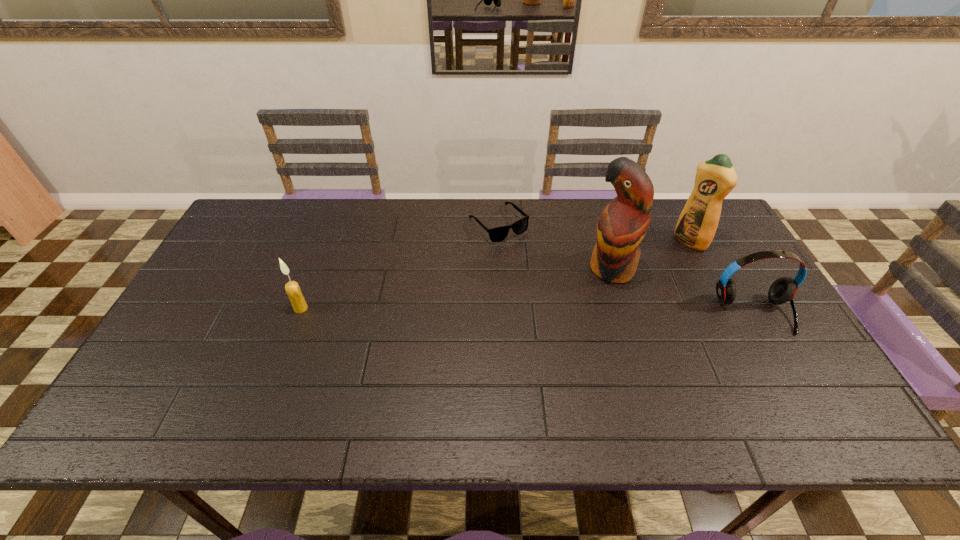
The image size is (960, 540). In order to click on free spot between the fourth object from right to left and the second tallest object in this screenshot , I will do `click(594, 233)`.

Find the location of `vacant region between the third object from left to right and the headset`. vacant region between the third object from left to right and the headset is located at coordinates (683, 291).

Where is `free space between the sunglasses and the fourth shortest object`? free space between the sunglasses and the fourth shortest object is located at coordinates (594, 233).

Where is `free area in between the sunglasses and the third object from right to left`? free area in between the sunglasses and the third object from right to left is located at coordinates (555, 246).

Identify the location of unoccupied area between the second object from left to right and the detergent. (594, 233).

Where is `free space that is in between the detergent and the parrot`? free space that is in between the detergent and the parrot is located at coordinates (651, 255).

The image size is (960, 540). Identify the location of vacant space that's between the candle and the headset. (527, 311).

This screenshot has width=960, height=540. What are the coordinates of `vacant area that lies between the detergent and the sunglasses` in the screenshot? It's located at (594, 233).

You are a GUI agent. You are given a task and a screenshot of the screen. Output one action in this format:
    pyautogui.click(x=<x>, y=<y>)
    Task: Click on the fourth closest object relative to the tallest object
    The image size is (960, 540).
    Given the screenshot: What is the action you would take?
    pyautogui.click(x=292, y=288)

Identify which object is located as the nearest to the headset. Please provide its 2D coordinates. Your answer should be formatted as a tuple, i.e. [(x, y)], where the tuple contains the x and y coordinates of a point satisfying the conditions above.

[(715, 178)]